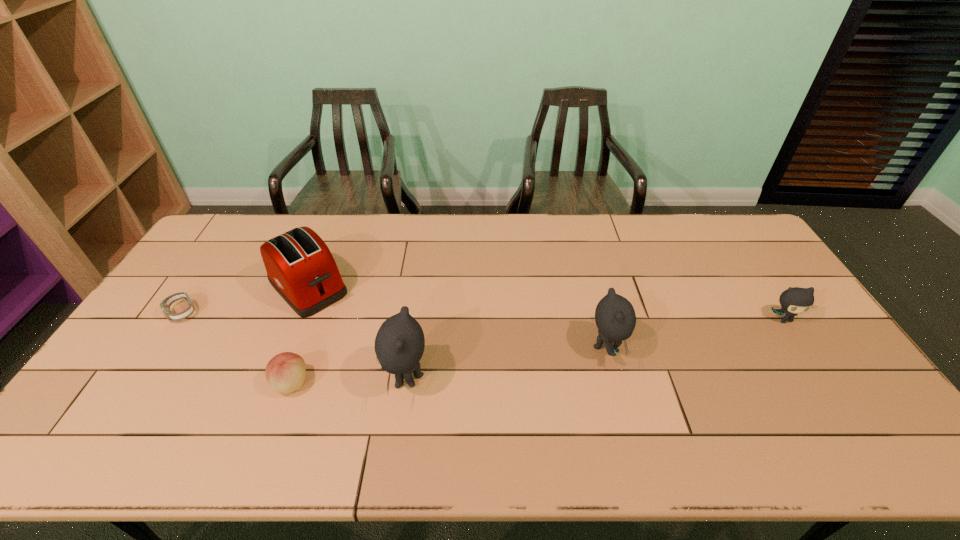
Locate an element on the screen. the fourth object from left to right is located at coordinates (399, 345).

Locate an element on the screen. The width and height of the screenshot is (960, 540). the second shortest kitten is located at coordinates [x=615, y=318].

This screenshot has height=540, width=960. What are the coordinates of `the second object from right to left` in the screenshot? It's located at (615, 318).

At what (x,y) coordinates should I click in order to perform the action: click on the rightmost object. Please return your answer as a coordinate pair (x, y). This screenshot has height=540, width=960. Looking at the image, I should click on (796, 300).

Where is `the fourth tallest object`? the fourth tallest object is located at coordinates (796, 300).

Locate an element on the screen. watch is located at coordinates (165, 305).

This screenshot has width=960, height=540. In order to click on the shortest object in this screenshot , I will do `click(165, 305)`.

This screenshot has height=540, width=960. I want to click on toaster, so click(300, 267).

What are the coordinates of `peach` in the screenshot? It's located at (285, 372).

Where is `free space located 0.390m on the front-facing side of the leftmost kitten`? The image size is (960, 540). free space located 0.390m on the front-facing side of the leftmost kitten is located at coordinates (234, 379).